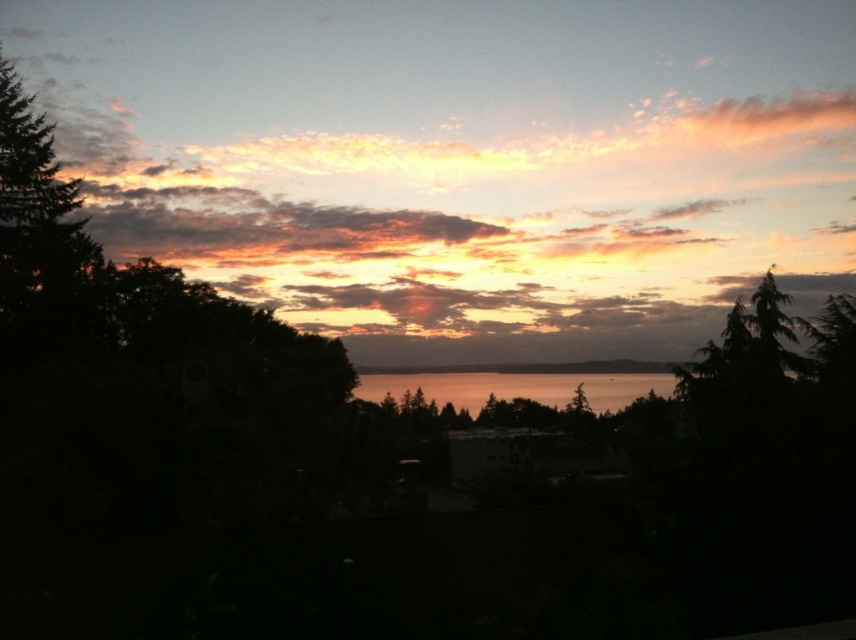
What do you see at coordinates (468, 198) in the screenshot? The height and width of the screenshot is (640, 856). I see `cloudy sky at upper center` at bounding box center [468, 198].

Between cloudy sky at upper center and shiny metallic water at center, which one has less height?

shiny metallic water at center is shorter.

Is point (57, 61) farther from camera compared to point (605, 403)?

Yes, point (57, 61) is farther from viewer.

You are a GUI agent. You are given a task and a screenshot of the screen. Output one action in this format:
    pyautogui.click(x=<x>, y=<y>)
    Task: Click on the cloudy sky at upper center
    Image resolution: width=856 pixels, height=640 pixels.
    Given the screenshot: What is the action you would take?
    tap(468, 198)